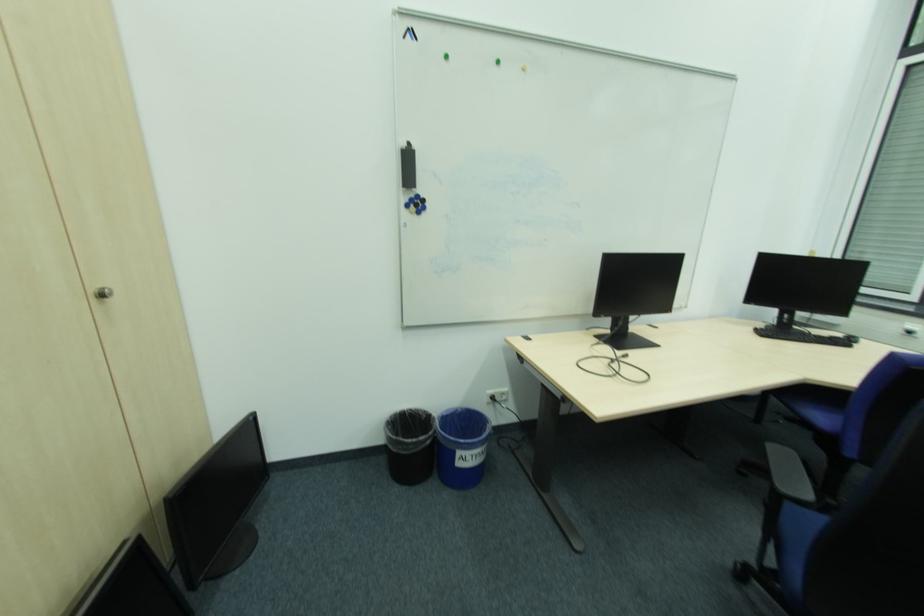
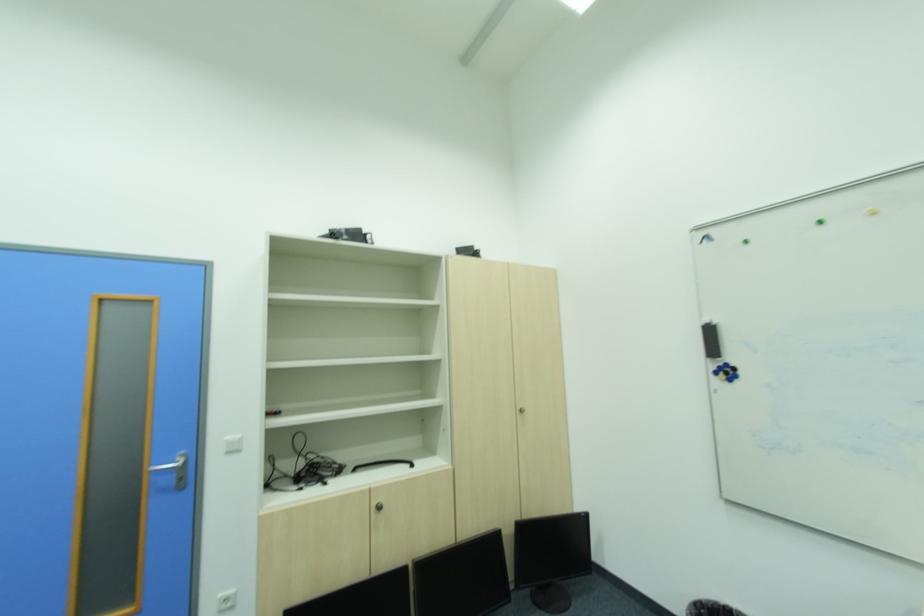
Locate, in the second image, the point that corresponds to pixel 416 158 in the first image.

(716, 331)